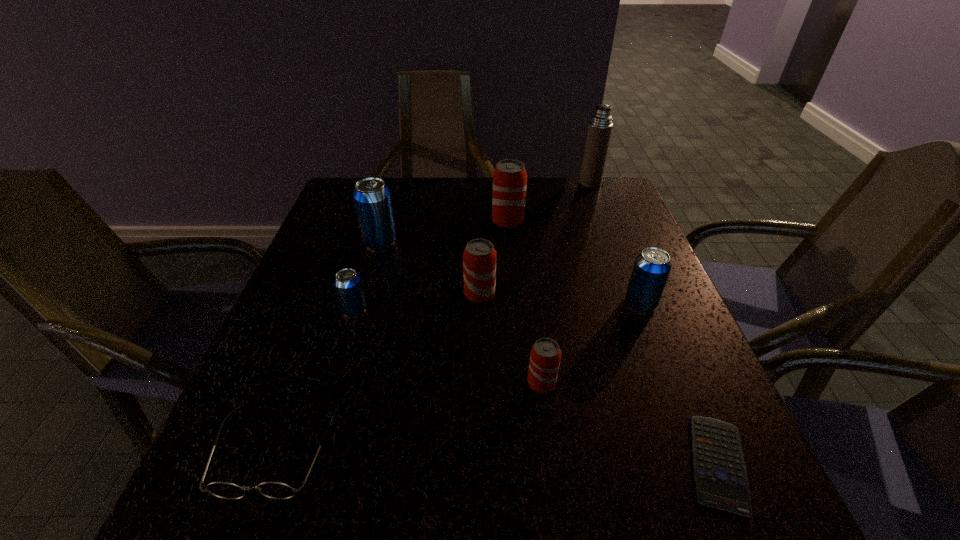
Where is `empty location between the second smallest orange beer can and the rightmost blue beer can`? The width and height of the screenshot is (960, 540). empty location between the second smallest orange beer can and the rightmost blue beer can is located at coordinates (561, 299).

Locate an element on the screen. The width and height of the screenshot is (960, 540). vacant area that lies between the calculator and the biggest orange beer can is located at coordinates (612, 343).

In order to click on empty location between the rightmost beer can and the smallest blue beer can in this screenshot , I will do `click(497, 307)`.

This screenshot has width=960, height=540. I want to click on free area in between the farthest orange beer can and the second biggest blue beer can, so click(x=574, y=262).

In order to click on free spot between the smallest orange beer can and the shortest object in this screenshot , I will do `click(630, 423)`.

Locate an element on the screen. vacant point located between the thermos bottle and the nearest beer can is located at coordinates (566, 282).

This screenshot has height=540, width=960. I want to click on vacant area between the farthest beer can and the second smallest blue beer can, so click(x=574, y=262).

I want to click on free space between the rightmost blue beer can and the farthest orange beer can, so coord(574,262).

Identify the location of object identified as the eighth closest to the calculator. (600, 126).

Identify the location of object that is the fifth nearest to the rightmost beer can. The width and height of the screenshot is (960, 540). click(600, 126).